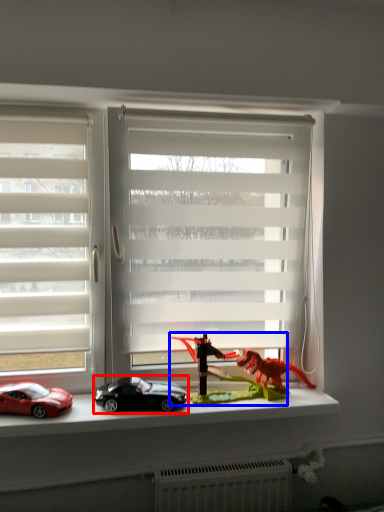
Question: Among these objects, which one is farthest to the camera, car (highlighted by a red box) or toy (highlighted by a blue box)?

Choices:
 (A) car
 (B) toy

Answer: (B)